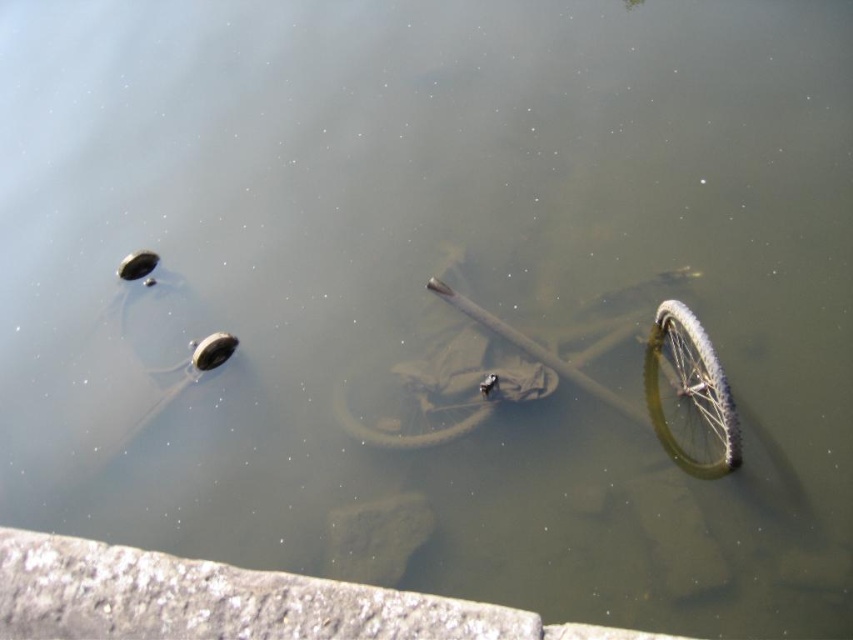
Question: Which object is positioned closest to the green rubber bicycle at center?

Choices:
 (A) green rubber tire at lower right
 (B) green rubber tire at center

Answer: (A)

Question: Does green rubber bicycle at center come in front of green rubber tire at lower right?

Choices:
 (A) no
 (B) yes

Answer: (A)

Question: Which of the following is the closest to the observer?

Choices:
 (A) green rubber tire at center
 (B) green rubber bicycle at center
 (C) green rubber tire at lower right

Answer: (C)

Question: Which point appears farthest from the camera in this image?

Choices:
 (A) (717, 380)
 (B) (721, 394)

Answer: (A)

Question: Is green rubber bicycle at center positioned behind green rubber tire at lower right?

Choices:
 (A) no
 (B) yes

Answer: (B)

Question: Does green rubber bicycle at center have a greater width compared to green rubber tire at center?

Choices:
 (A) no
 (B) yes

Answer: (B)